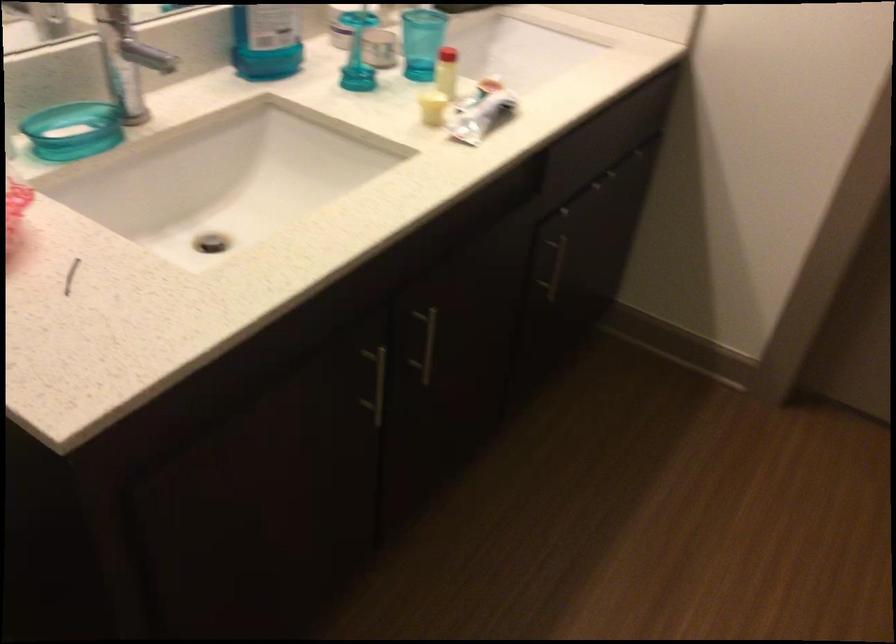
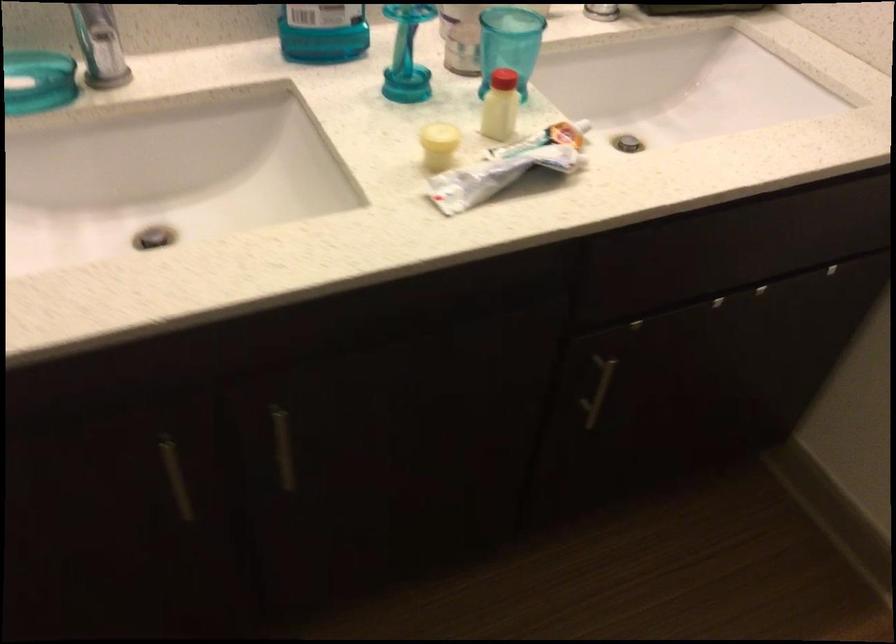
Question: Based on the continuous images, in which direction is the camera rotating? Reply with the corresponding letter.

Choices:
 (A) Left
 (B) Right
 (C) Up
 (D) Down

Answer: (A)